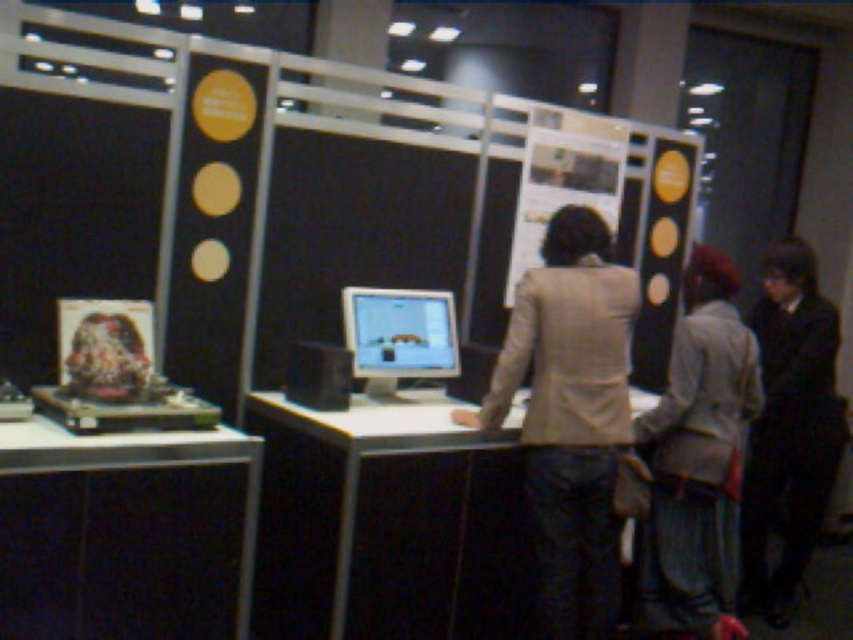
Question: Which point is farther to the camera?

Choices:
 (A) (537, 400)
 (B) (181, 493)
 (C) (473, 529)

Answer: (C)

Question: Among these objects, which one is nearest to the camera?

Choices:
 (A) beige fabric jacket at center
 (B) metallic silver computer at center

Answer: (B)

Question: Which object is closer to the camera taking this photo?

Choices:
 (A) light gray fabric jacket at center
 (B) black fabric jacket at upper right

Answer: (A)

Question: Does light gray fabric jacket at center have a lesser width compared to black fabric jacket at upper right?

Choices:
 (A) yes
 (B) no

Answer: (A)

Question: Is metallic silver computer at center to the right of beige fabric jacket at center from the viewer's perspective?

Choices:
 (A) no
 (B) yes

Answer: (A)

Question: Does beige fabric jacket at center appear on the left side of light gray fabric jacket at center?

Choices:
 (A) yes
 (B) no

Answer: (A)